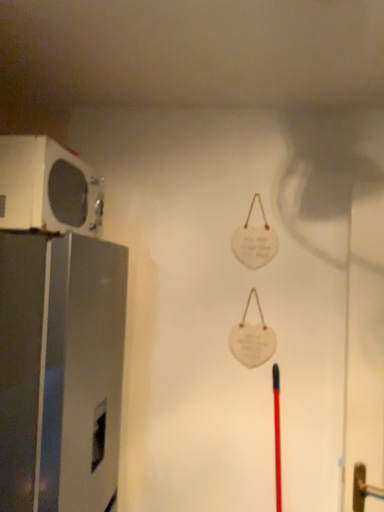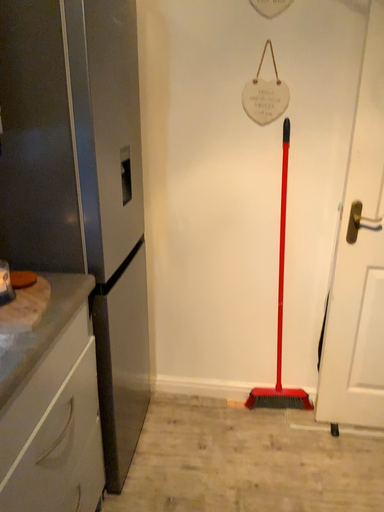
Question: Which way did the camera rotate in the video?

Choices:
 (A) rotated upward
 (B) rotated downward

Answer: (B)